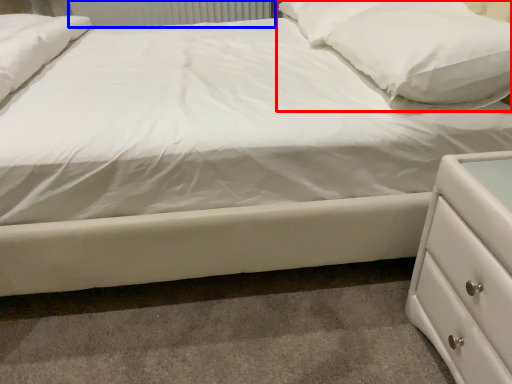
Question: Which point is closer to the camera, pillow (highlighted by a red box) or radiator (highlighted by a blue box)?

Choices:
 (A) pillow
 (B) radiator

Answer: (A)